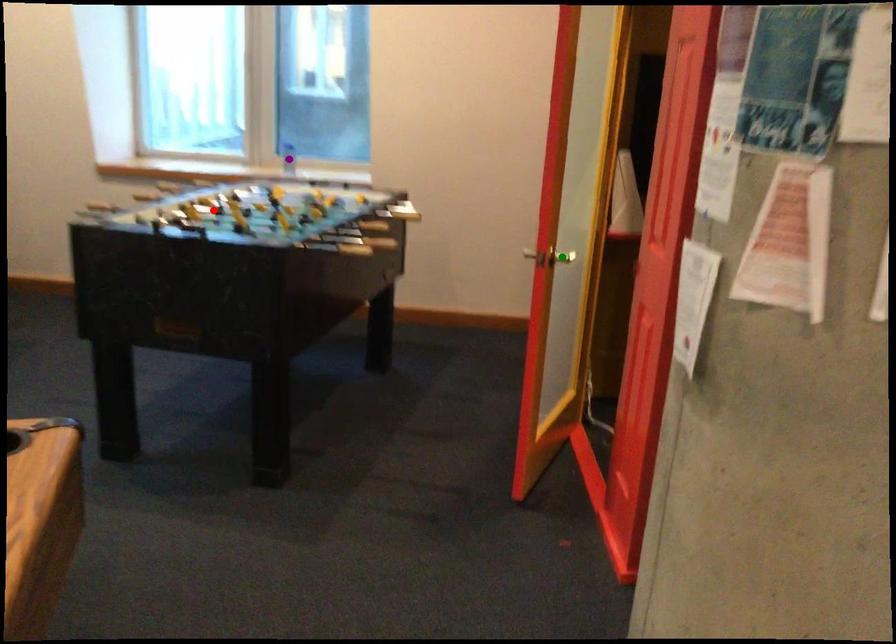
Order these from nearest to farthest:
purple point
red point
green point

green point < red point < purple point